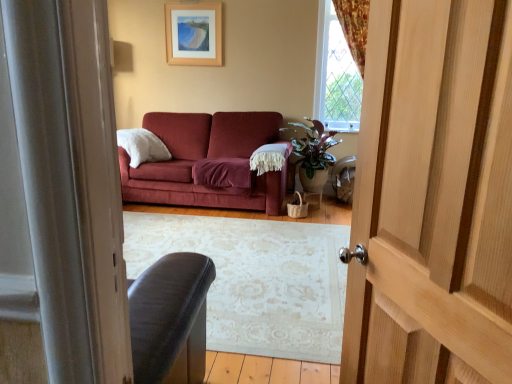
Question: Do you think clear glass window at upper right is within light brown wooden door at right, or outside of it?

Choices:
 (A) outside
 (B) inside

Answer: (A)

Question: Considering the relative positions of clear glass window at upper right and light brown wooden door at right in the image provided, is clear glass window at upper right to the left or to the right of light brown wooden door at right?

Choices:
 (A) left
 (B) right

Answer: (B)

Question: Based on their relative distances, which object is nearer to the wooden picture frame at upper center?

Choices:
 (A) light brown wooden door at right
 (B) clear glass window at upper right
 (C) green glossy plant at center

Answer: (B)

Question: Estimate the real-world distances between objects in this image. Which object is farther from the light brown wooden door at right?

Choices:
 (A) wooden picture frame at upper center
 (B) clear glass window at upper right
 (C) green glossy plant at center

Answer: (A)